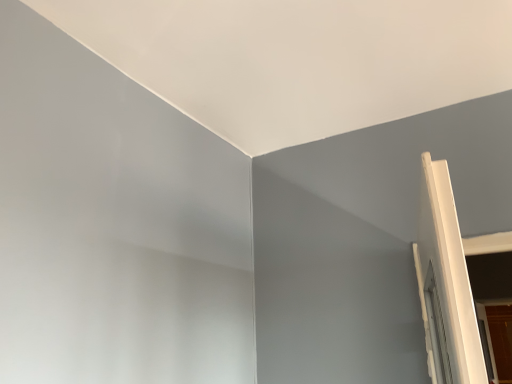
The width and height of the screenshot is (512, 384). Describe the element at coordinates (501, 339) in the screenshot. I see `clear glass screen door at right` at that location.

The image size is (512, 384). Identify the location of clear glass screen door at right. (501, 339).

The image size is (512, 384). I want to click on clear glass screen door at right, so click(x=501, y=339).